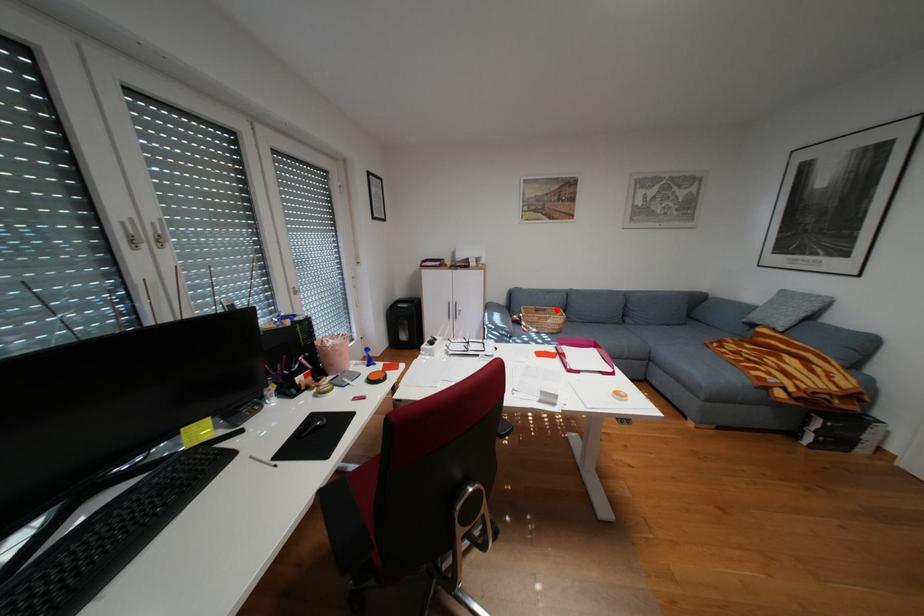
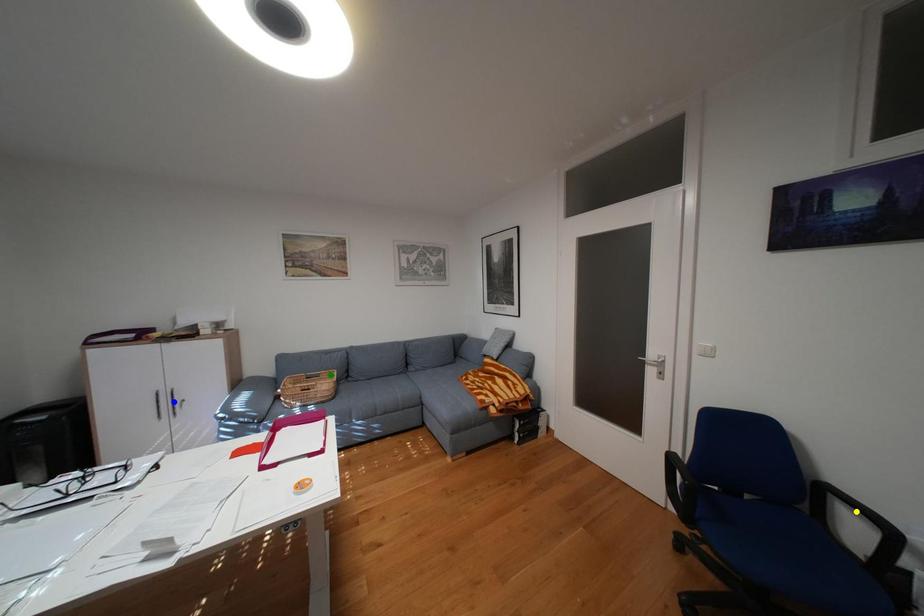
Question: I am providing you with two images of the same scene from different viewpoints. A red point is marked on the first image. You are given multiple points on the second image. Which point in image 2 represents the same 3d spot as the red point in image 1?

Choices:
 (A) blue point
 (B) green point
 (C) yellow point

Answer: (B)